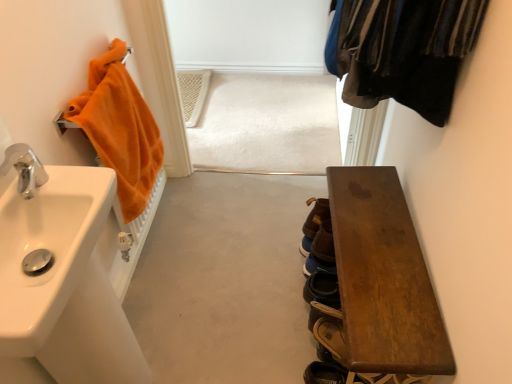
Question: Is wooden bench at lower right not within orange terry cloth towel at left?

Choices:
 (A) no
 (B) yes

Answer: (B)

Question: Can orange terry cloth towel at left be found inside wooden bench at lower right?

Choices:
 (A) yes
 (B) no

Answer: (B)

Question: From the image's perspective, does wooden bench at lower right appear higher than orange terry cloth towel at left?

Choices:
 (A) yes
 (B) no

Answer: (B)

Question: Is wooden bench at lower right oriented away from orange terry cloth towel at left?

Choices:
 (A) no
 (B) yes

Answer: (A)

Question: Can you see wooden bench at lower right touching orange terry cloth towel at left?

Choices:
 (A) yes
 (B) no

Answer: (B)

Question: From a real-world perspective, is brown leather shoe at lower right, the 3th shoe when ordered from top to bottom, physically located above or below brown leather shoe at lower right, positioned as the 3th shoe in front-to-back order?

Choices:
 (A) above
 (B) below

Answer: (B)

Question: Is brown leather shoe at lower right, the third shoe viewed from the back, in front of or behind brown leather shoe at lower right, positioned as the 3th shoe in front-to-back order, in the image?

Choices:
 (A) front
 (B) behind

Answer: (A)

Question: Is brown leather shoe at lower right, the third shoe viewed from the back, taller or shorter than brown leather shoe at lower right, marked as the 2th shoe in a top-to-bottom arrangement?

Choices:
 (A) tall
 (B) short

Answer: (B)

Question: Looking at their shapes, would you say brown leather shoe at lower right, which is counted as the first shoe, starting from the bottom, is wider or thinner than brown leather shoe at lower right, placed as the second shoe when sorted from bottom to top?

Choices:
 (A) wide
 (B) thin

Answer: (A)

Question: Is silver metallic faucet at left spatially inside brown leather shoe at lower right, marked as the 2th shoe in a top-to-bottom arrangement, or outside of it?

Choices:
 (A) outside
 (B) inside

Answer: (A)

Question: Is silver metallic faucet at left wider or thinner than brown leather shoe at lower right, positioned as the 3th shoe in front-to-back order?

Choices:
 (A) thin
 (B) wide

Answer: (A)

Question: Looking at the image, does silver metallic faucet at left seem bigger or smaller compared to brown leather shoe at lower right, marked as the 2th shoe in a top-to-bottom arrangement?

Choices:
 (A) big
 (B) small

Answer: (B)

Question: From their relative heights in the image, would you say silver metallic faucet at left is taller or shorter than brown leather shoe at lower right, placed as the second shoe when sorted from bottom to top?

Choices:
 (A) short
 (B) tall

Answer: (A)

Question: Do you think brown suede shoe at lower center, which ranks as the 2th shoe in back-to-front order, is within brown leather shoe at lower right, which is counted as the first shoe, starting from the bottom, or outside of it?

Choices:
 (A) inside
 (B) outside

Answer: (B)

Question: From the image's perspective, is brown suede shoe at lower center, which ranks as the 2th shoe in back-to-front order, located above or below brown leather shoe at lower right, the 3th shoe when ordered from top to bottom?

Choices:
 (A) below
 (B) above

Answer: (B)